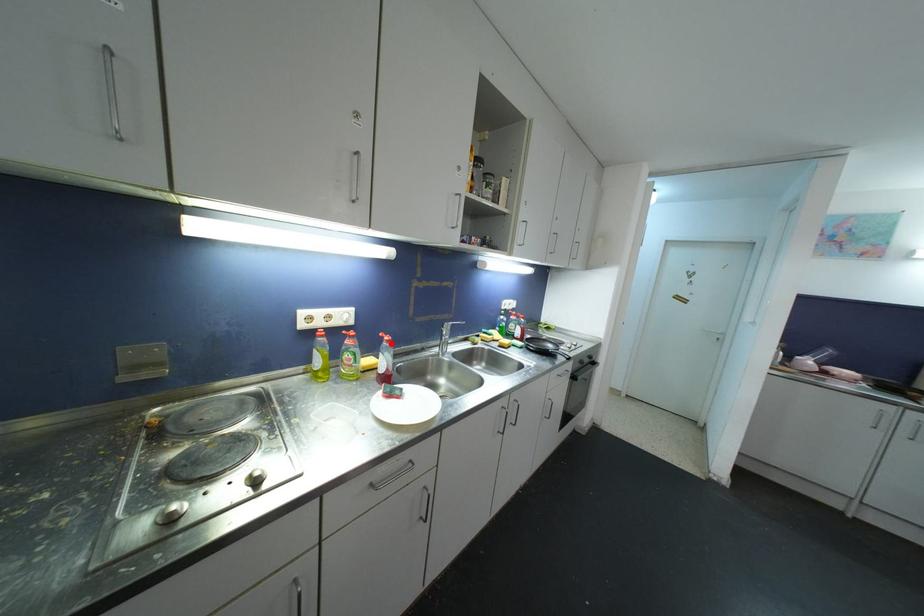
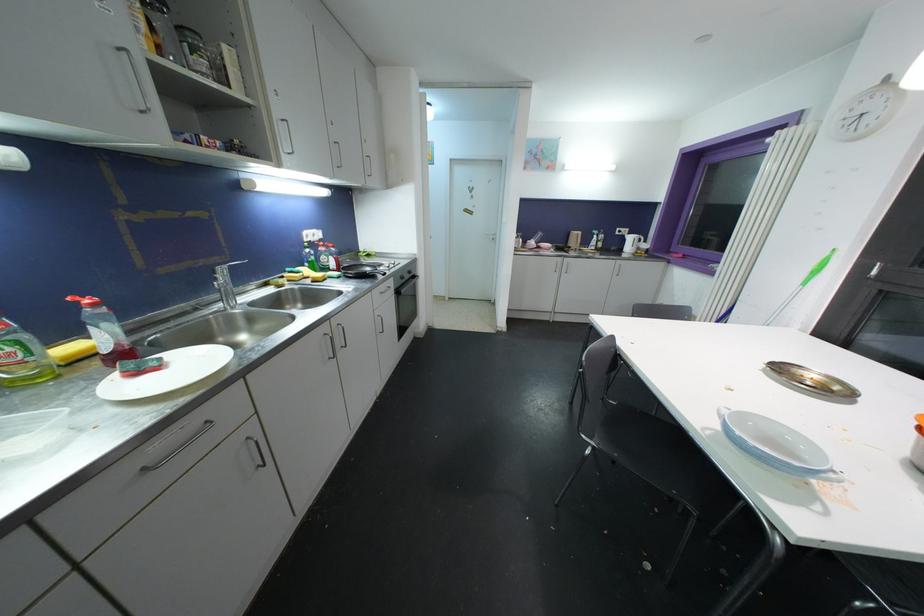
Find the pixel in the second image that matches the highlighted location in the first image.

(98, 308)